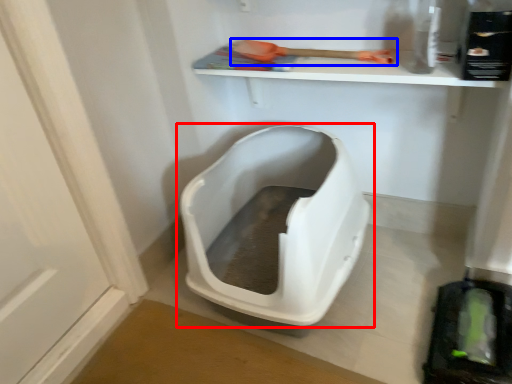
Question: Which of the following is the closest to the observer, toilet (highlighted by a red box) or tool (highlighted by a blue box)?

Choices:
 (A) toilet
 (B) tool

Answer: (A)